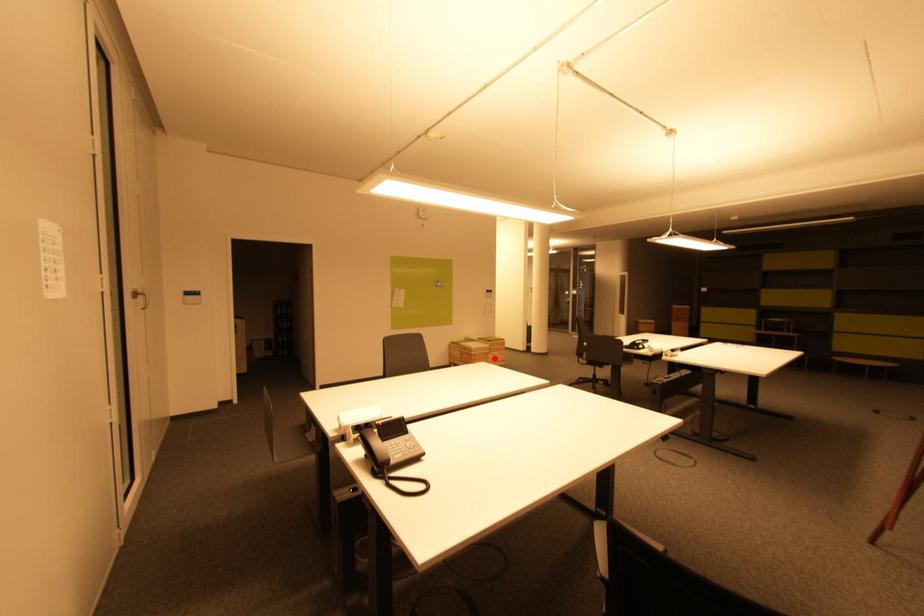
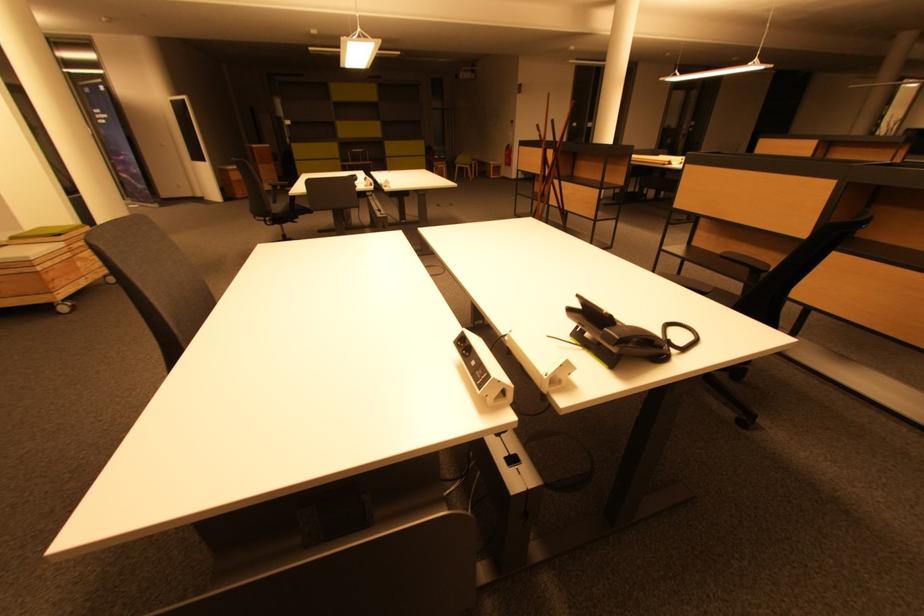
The point at the highlighted location is marked in the first image. Where is the corresponding point in the second image?

(83, 265)